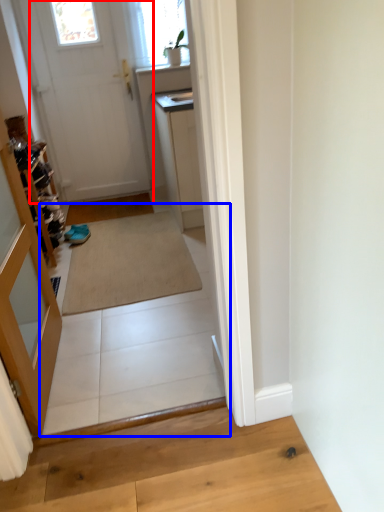
Question: Which object appears farthest to the camera in this image, door (highlighted by a red box) or path (highlighted by a blue box)?

Choices:
 (A) door
 (B) path

Answer: (A)